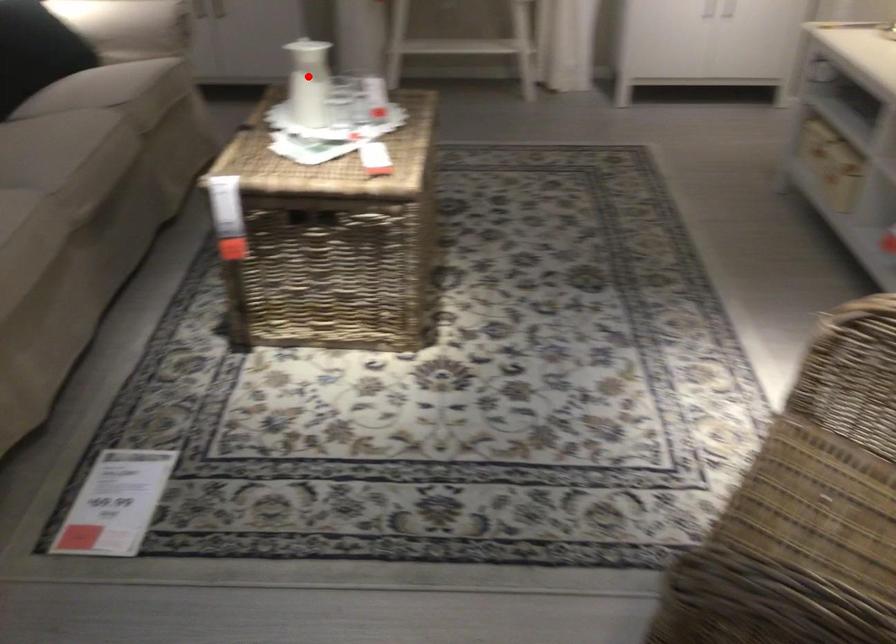
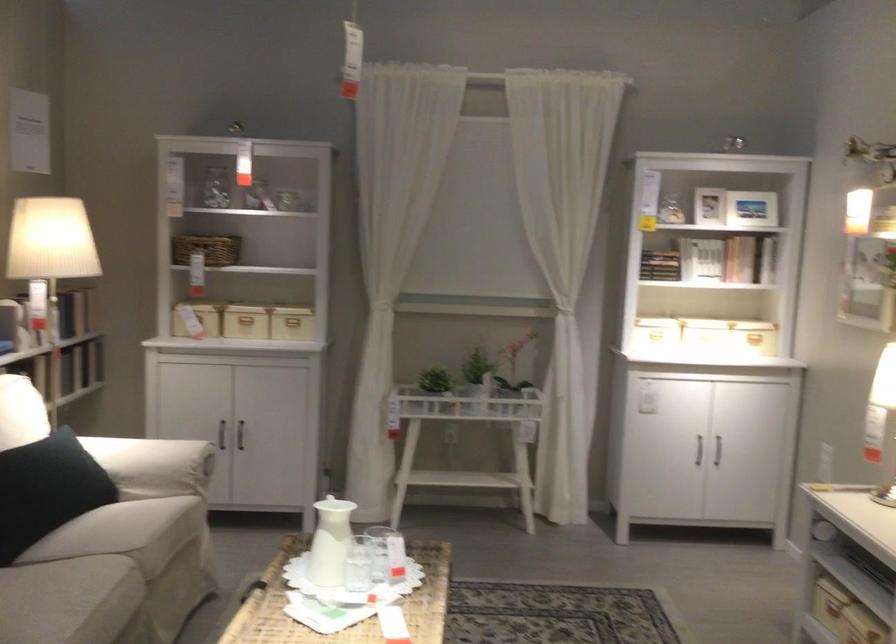
Find the pixel in the second image that matches the highlighted location in the first image.

(330, 542)